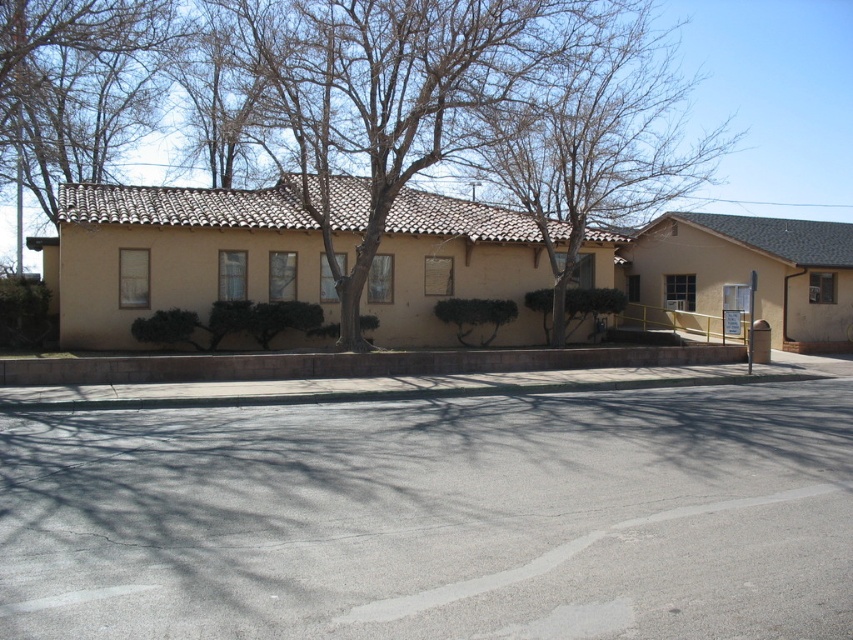
Question: Does bare branches at upper center lie in front of bare branches at upper left?

Choices:
 (A) no
 (B) yes

Answer: (A)

Question: Considering the real-world distances, which object is closest to the brown concrete curb at lower center?

Choices:
 (A) bare branches at upper left
 (B) bare branches at center
 (C) bare branches at upper center

Answer: (B)

Question: Considering the relative positions of bare branches at center and bare branches at upper center in the image provided, where is bare branches at center located with respect to bare branches at upper center?

Choices:
 (A) above
 (B) below

Answer: (B)

Question: Is bare branches at center above bare branches at upper center?

Choices:
 (A) yes
 (B) no

Answer: (B)

Question: Based on their relative distances, which object is nearer to the bare branches at upper left?

Choices:
 (A) brown concrete curb at lower center
 (B) bare branches at center
 (C) bare branches at upper center

Answer: (B)

Question: Which point is closer to the camera taking this photo?

Choices:
 (A) (49, 211)
 (B) (508, 140)

Answer: (B)